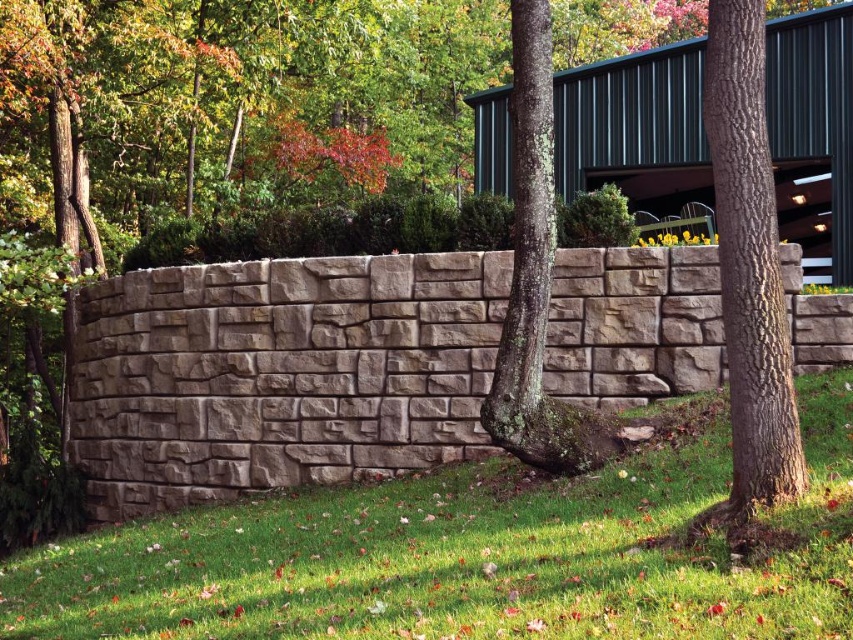
You are standing at the point marked by the coordinate point (467, 556) in the scene. What do you see directly beneath your feet?

The point (467, 556) marks green grass at center, so you would see green grass directly beneath your feet.

You are standing at the edge of the curved stone retaining wall and want to reach the green grass at center. Which direction should you walk to get there?

The green grass at center is located at point coordinates, so you should walk towards the center of the image to reach it.